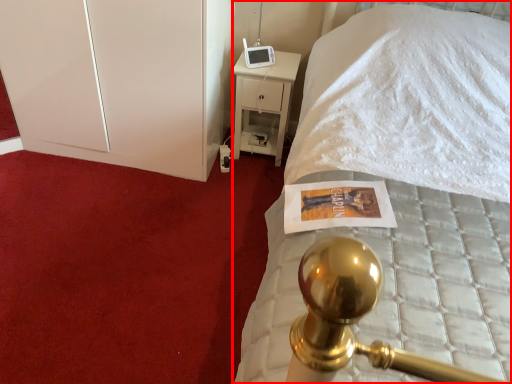
Question: Observing the image, what is the correct spatial positioning of bed (annotated by the red box) in reference to dresser?

Choices:
 (A) left
 (B) right

Answer: (B)